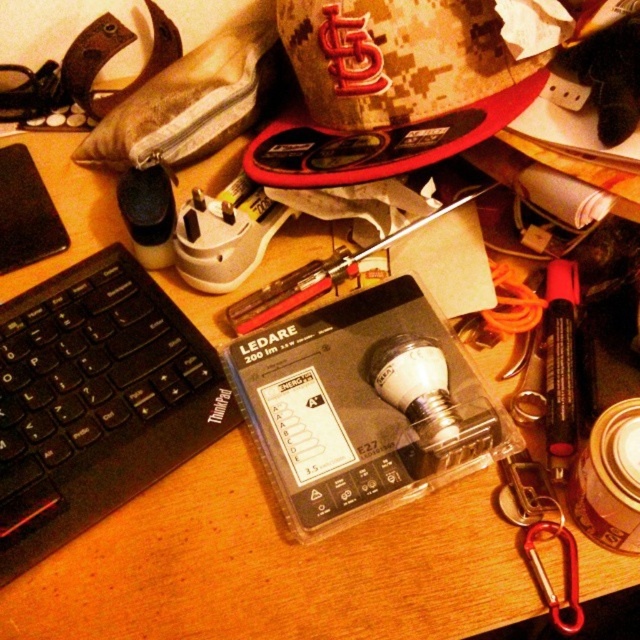
Looking at this image, you are organizing your desk and need to place the black plastic keyboard at left and the metallic screwdriver at center into a drawer. Which object should you put first if you want to start with the one closer to the right side of the desk?

You should place the metallic screwdriver at center first because it is positioned to the right of the black plastic keyboard at left, making it closer to the right side of the desk.

You are a photographer setting up a shot of the black plastic keyboard at left. The camera is positioned so that the keyboard is in focus. If you want to include the packaged LEDARE light bulb from IKEA in the shot without moving the camera, will the light bulb be in focus?

The black plastic keyboard at left is 47.33 centimeters from the camera. Since the light bulb is farther away than the keyboard, it may not be in focus unless the depth of field is sufficient to include both. However, without knowing the exact depth of field settings, it is uncertain. But based on typical photography principles, if the keyboard is in focus and the light bulb is further away, it might be slightly out of focus depending on the aperture used.

You are organizing your desk and need to place a 6.5 inch wide book between the black plastic keyboard at left and the metallic screwdriver at center. Is there enough space between them to fit the book?

The distance between the black plastic keyboard at left and the metallic screwdriver at center is 5.42 inches, which is less than the 6.5 inch width of the book. Therefore, there isn not enough space to fit the book between them.